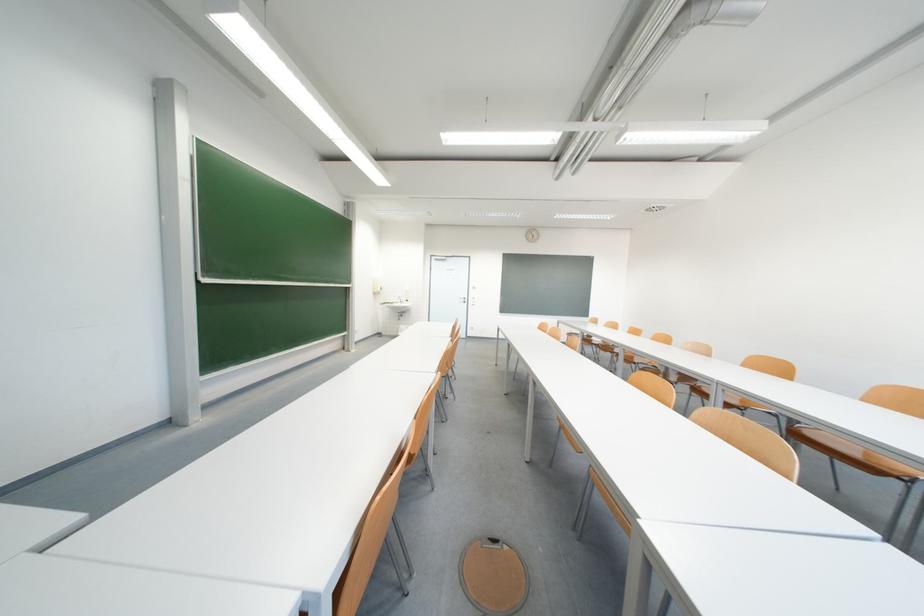
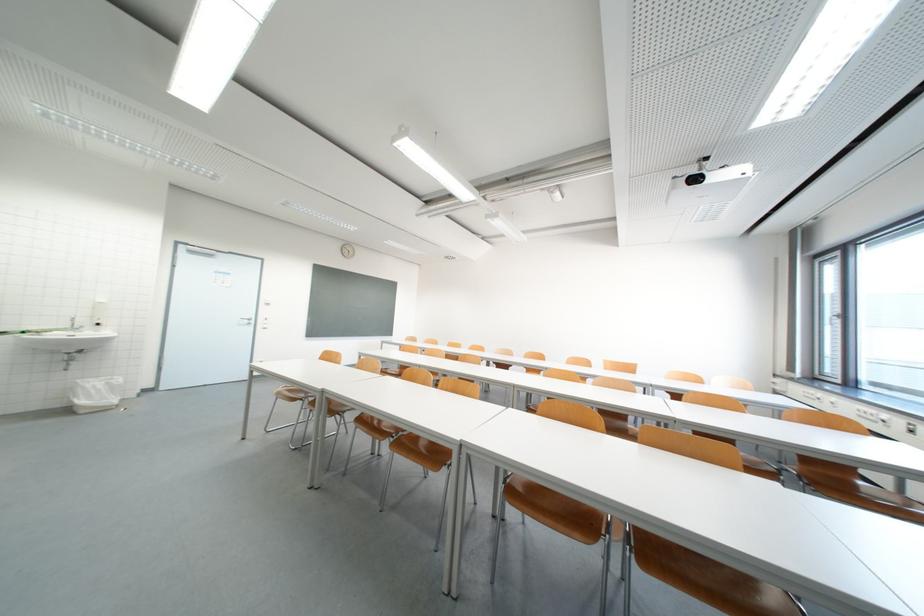
Where in the second image is the point corresponding to (411,301) from the first image?

(93, 323)